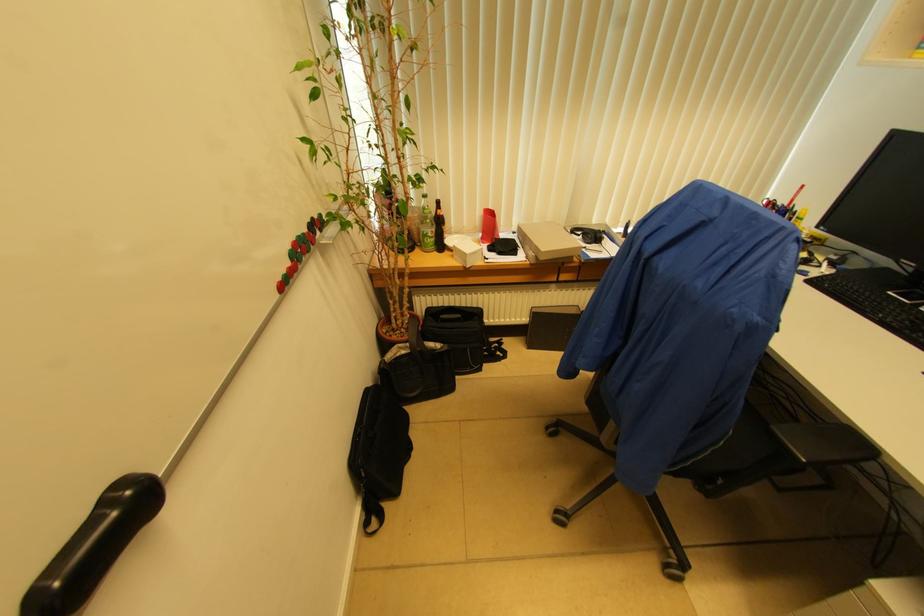
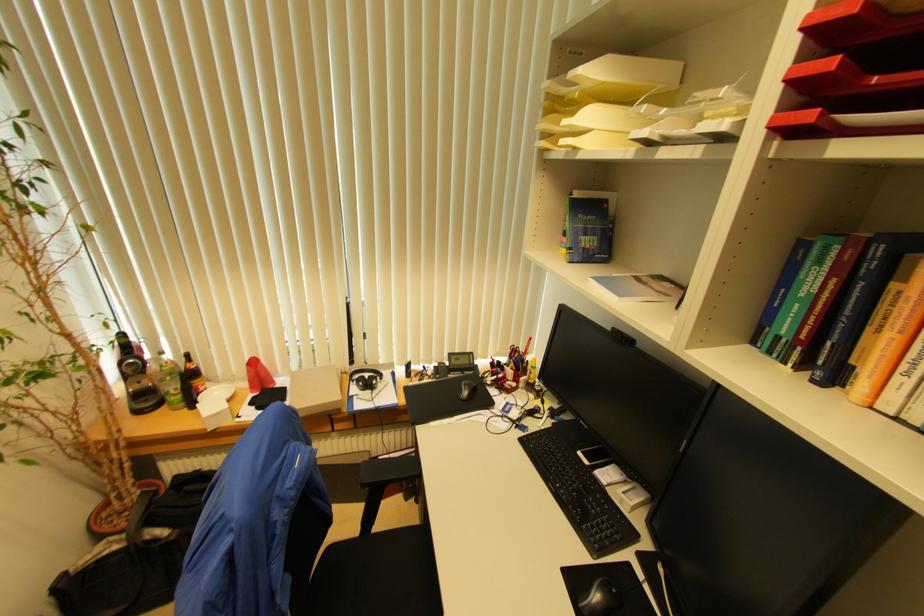
Where in the second image is the point corresponding to point 431,237 from the first image?

(174, 394)